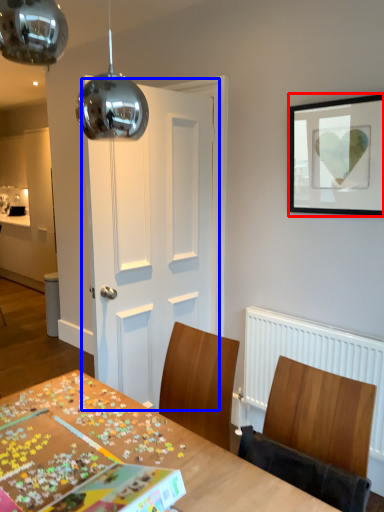
Question: Which object appears closest to the camera in this image, picture frame (highlighted by a red box) or door (highlighted by a blue box)?

Choices:
 (A) picture frame
 (B) door

Answer: (A)